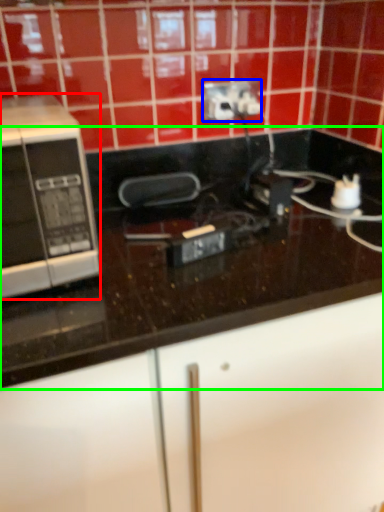
Question: Which is farther away from microwave oven (highlighted by a red box)? power plugs and sockets (highlighted by a blue box) or countertop (highlighted by a green box)?

Choices:
 (A) power plugs and sockets
 (B) countertop

Answer: (A)